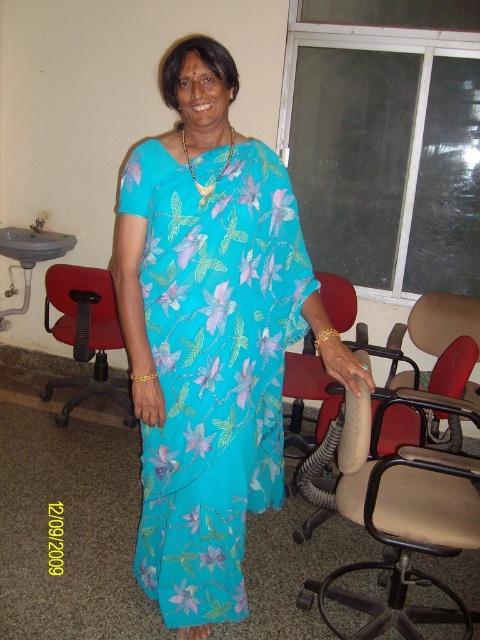
Between turquoise floral fabric dress at center and matte red chair at left, which one has less height?

matte red chair at left is shorter.

The height and width of the screenshot is (640, 480). In order to click on turquoise floral fabric dress at center in this screenshot , I will do pyautogui.click(x=213, y=364).

This screenshot has height=640, width=480. What do you see at coordinates (213, 364) in the screenshot?
I see `turquoise floral fabric dress at center` at bounding box center [213, 364].

Where is `turquoise floral fabric dress at center`? turquoise floral fabric dress at center is located at coordinates (213, 364).